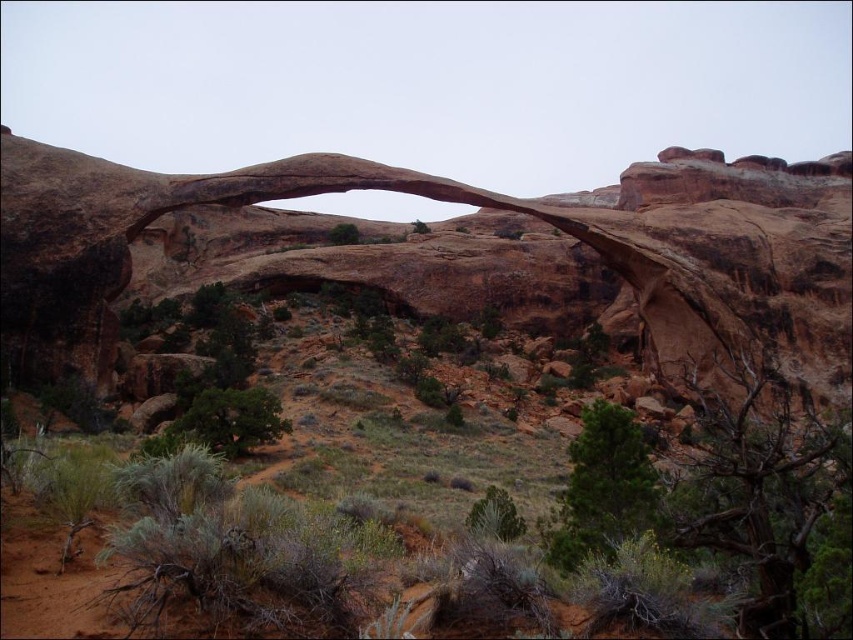
Can you confirm if green needle-like at center is positioned above green leafy bush at center?

Indeed, green needle-like at center is positioned over green leafy bush at center.

Describe the element at coordinates (602, 486) in the screenshot. I see `green needle-like at center` at that location.

Identify the location of green needle-like at center. This screenshot has height=640, width=853. (602, 486).

Which of these two, green shrubs at center or green leafy bush at lower left, stands shorter?

green leafy bush at lower left

Between point (764, 632) and point (190, 422), which one is positioned in front?

Point (764, 632) is more forward.

I want to click on green shrubs at center, so click(718, 509).

This screenshot has width=853, height=640. In order to click on green shrubs at center in this screenshot , I will do `click(718, 509)`.

Measure the distance between green leafy bush at lower left and green leafy shrub at center.

The distance of green leafy bush at lower left from green leafy shrub at center is 390.19 feet.

Who is more distant from viewer, (202, 403) or (346, 241)?

The point (346, 241) is more distant.

At what (x,y) coordinates should I click in order to perform the action: click on green leafy bush at lower left. Please return your answer as a coordinate pair (x, y). This screenshot has height=640, width=853. Looking at the image, I should click on (223, 420).